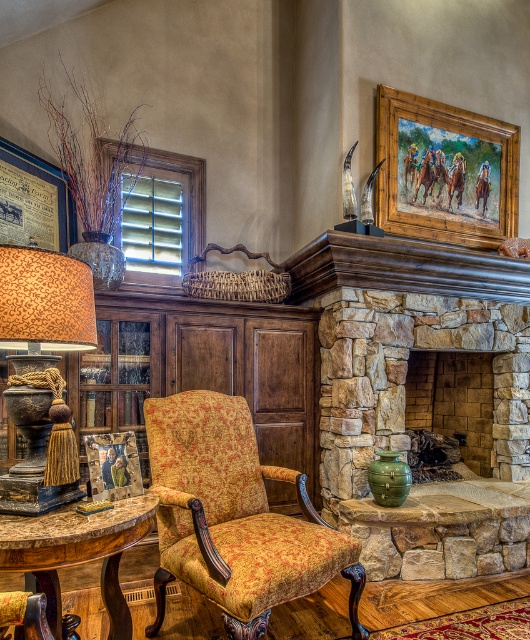
Does rustic wood table at lower left appear under brown stone fireplace at center?

Yes, rustic wood table at lower left is below brown stone fireplace at center.

Which is below, rustic wood table at lower left or brown stone fireplace at center?

Result: Positioned lower is rustic wood table at lower left.

You are a GUI agent. You are given a task and a screenshot of the screen. Output one action in this format:
    pyautogui.click(x=<x>, y=<y>)
    Task: Click on the rustic wood table at lower left
    The image size is (530, 640).
    Given the screenshot: What is the action you would take?
    pyautogui.click(x=77, y=552)

Consider the image. Is patterned fabric armchair at center further to camera compared to rustic wood table at lower left?

Yes.

Is patterned fabric armchair at center thinner than rustic wood table at lower left?

No.

Who is more distant from viewer, (223,400) or (32,534)?

Positioned behind is point (223,400).

The width and height of the screenshot is (530, 640). I want to click on patterned fabric armchair at center, so click(x=234, y=516).

Which is behind, point (240, 600) or point (55, 273)?

The point (240, 600) is behind.

Is point (280, 572) closer to viewer compared to point (38, 301)?

No, (280, 572) is behind (38, 301).

At what (x,y) coordinates should I click in order to perform the action: click on patterned fabric armchair at center. Please return your answer as a coordinate pair (x, y). Looking at the image, I should click on (234, 516).

This screenshot has width=530, height=640. Identify the location of patterned fabric armchair at center. (234, 516).